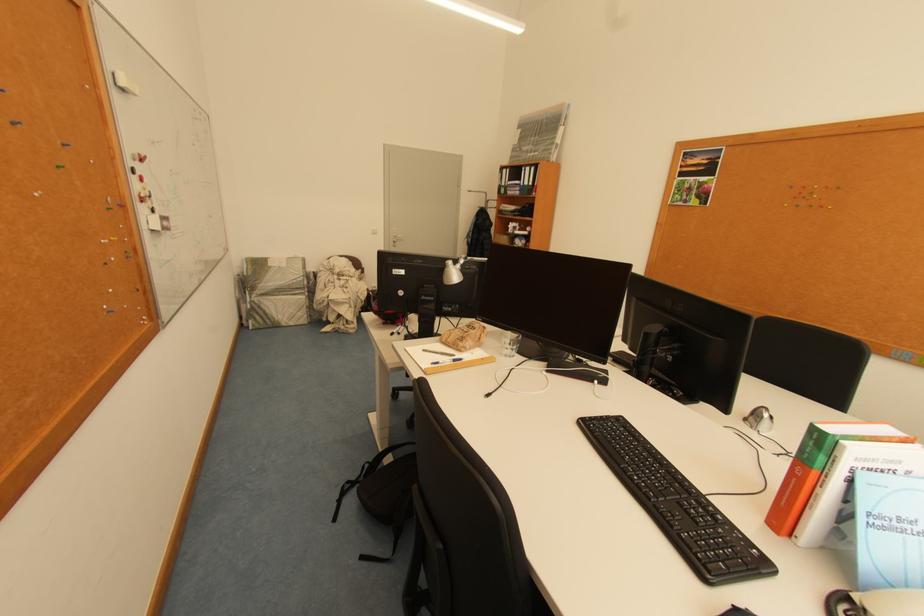
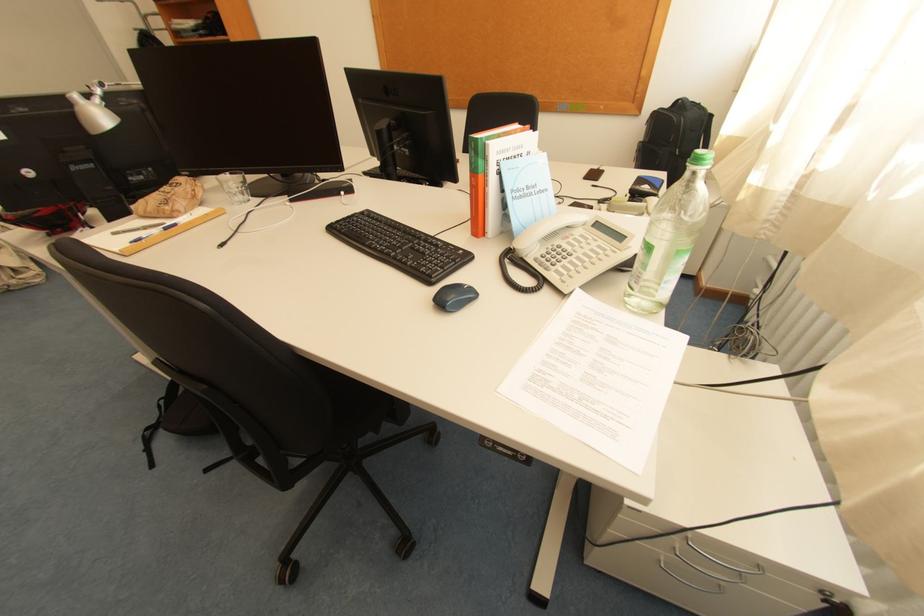
The point at [610,419] is marked in the first image. Where is the corresponding point in the second image?

(356, 219)